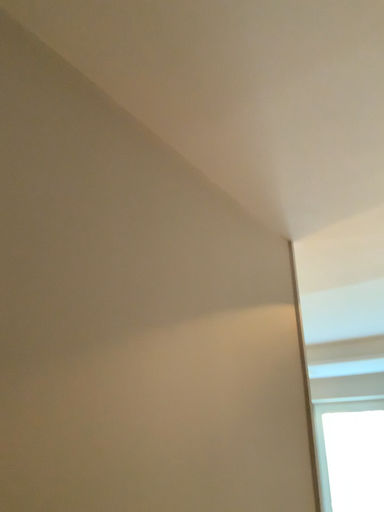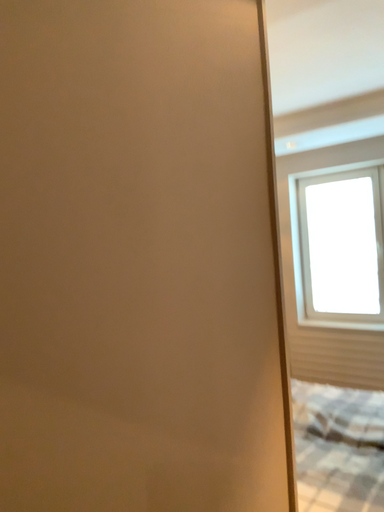
Question: Which way did the camera rotate in the video?

Choices:
 (A) rotated downward
 (B) rotated upward

Answer: (A)